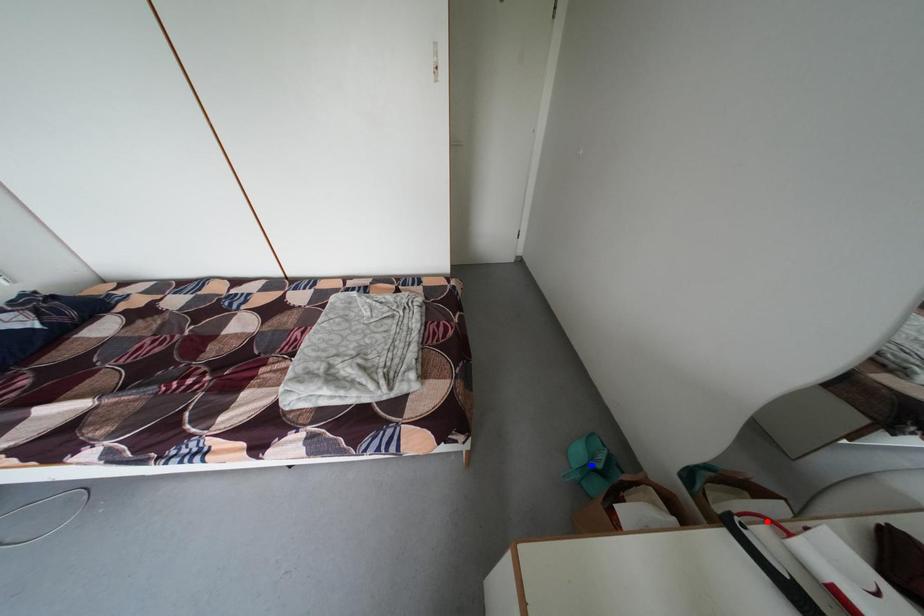
Question: In the image, two points are highlighted. Which point is nearer to the camera? Reply with the corresponding letter.

Choices:
 (A) blue point
 (B) red point

Answer: (B)